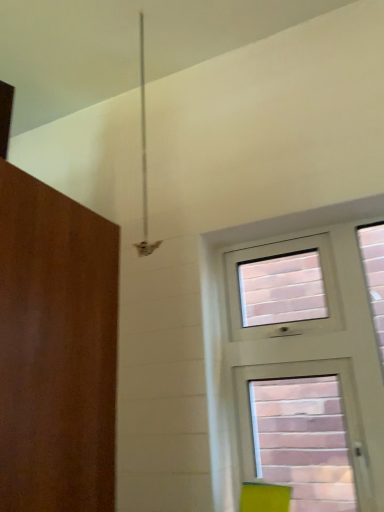
Describe the element at coordinates (227, 327) in the screenshot. This screenshot has width=384, height=512. I see `white plastic window at lower right` at that location.

The image size is (384, 512). I want to click on white plastic window at lower right, so click(227, 327).

Where is `white plastic window at lower right`? The image size is (384, 512). white plastic window at lower right is located at coordinates (227, 327).